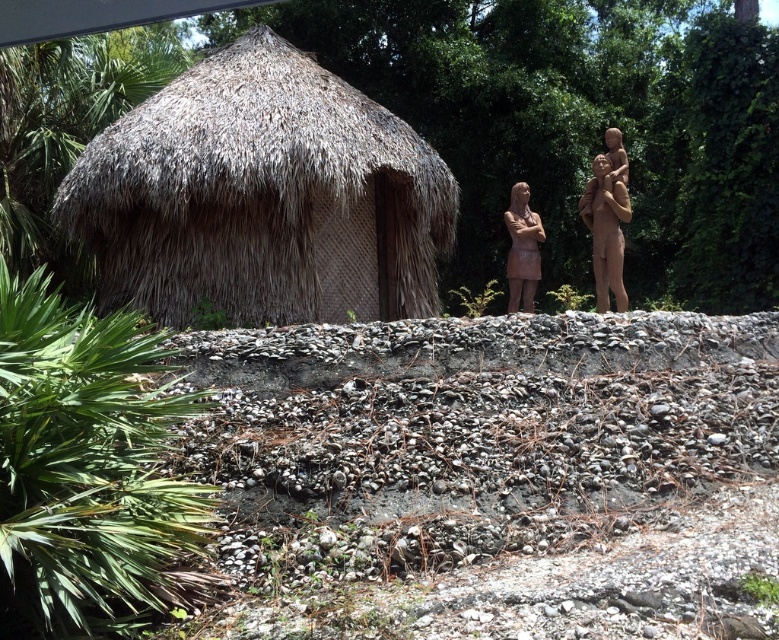
You are planning to place a new decorative pot that is 2 meters wide on the platform. Considering the space between the thatched straw hut at left and the matte bronze statue at center, will it fit?

The thatched straw hut at left might be wider than the matte bronze statue at center, but without exact measurements of the space between them, it is uncertain if the 2 meter wide pot will fit. Check the actual distance before placing the pot.

You are an artist visiting the thatched hut and want to place a new statue between the brown matte statue at right and the matte bronze statue at center. Based on their heights, which existing statue should your new statue be taller than to ensure it stands out more than both?

The brown matte statue at right is taller than the matte bronze statue at center. To make your new statue stand out more than both, it should be taller than the brown matte statue at right.

You are standing in front of the thatched straw hut at left and the brown matte statue at right. Which object is positioned further to the east?

The brown matte statue at right is positioned further to the east because it is to the right of the thatched straw hut at left.